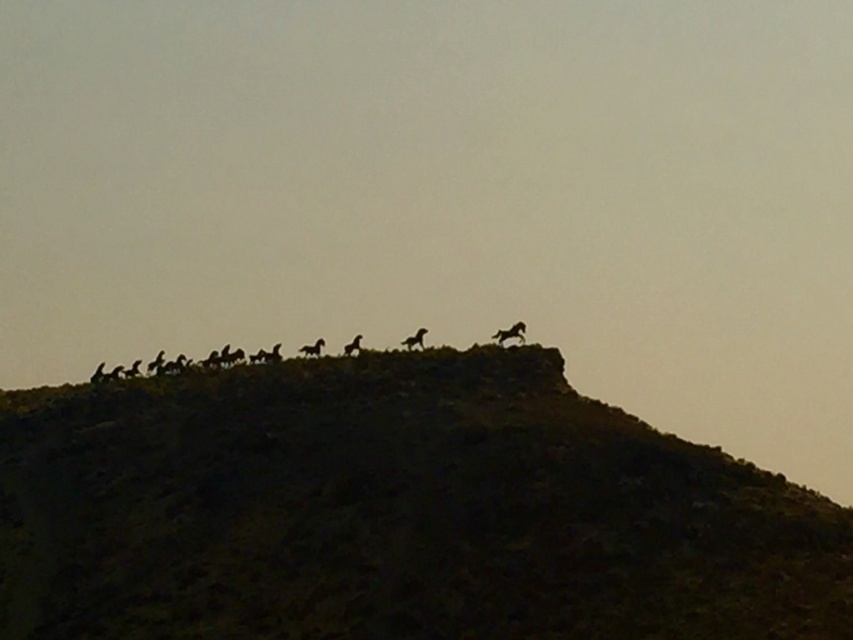
Question: Is black matte horse at upper center thinner than silhouette horse at upper center?

Choices:
 (A) yes
 (B) no

Answer: (B)

Question: Is dark brown textured hillside at upper center wider than silhouette fur at upper center?

Choices:
 (A) no
 (B) yes

Answer: (B)

Question: Is silhouette horse at center below silhouette horse at upper center?

Choices:
 (A) no
 (B) yes

Answer: (A)

Question: Which point is farther to the camera?

Choices:
 (A) silhouette horse at center
 (B) dark brown textured hillside at upper center

Answer: (A)

Question: Among these points, which one is farthest from the camera?

Choices:
 (A) (520, 330)
 (B) (360, 336)
 (C) (99, 376)

Answer: (C)

Question: Which point is closer to the camera?

Choices:
 (A) black matte horse at upper center
 (B) dark brown textured hillside at upper center

Answer: (B)